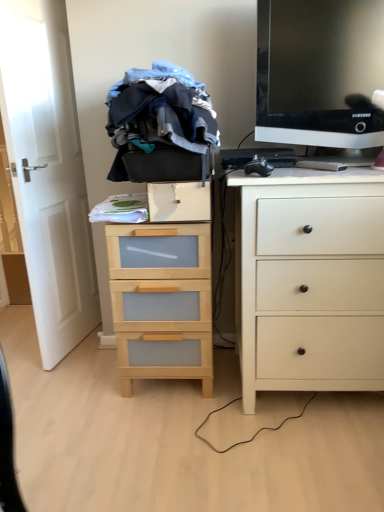
Question: Is point (289, 148) closer or farther from the camera than point (147, 356)?

Choices:
 (A) farther
 (B) closer

Answer: (B)

Question: From the image's perspective, is black plastic keyboard at center above or below wooden chest of drawers at center, the 1th chest of drawers from the left?

Choices:
 (A) below
 (B) above

Answer: (B)

Question: Estimate the real-world distances between objects in this image. Which object is farther from the wooden drawer at center?

Choices:
 (A) black plastic computer mouse at upper right
 (B) black plastic keyboard at center
 (C) wooden chest of drawers at center, the 1th chest of drawers from the left
 (D) white matte chest of drawers at right, the 1th chest of drawers viewed from the right
 (E) blue cotton clothes at center

Answer: (D)

Question: Which is nearer to the black plastic computer mouse at upper right?

Choices:
 (A) black glossy monitor at upper right
 (B) wooden chest of drawers at center, the 1th chest of drawers from the left
 (C) blue cotton clothes at center
 (D) black plastic keyboard at center
 (E) white matte chest of drawers at right, the 1th chest of drawers viewed from the right

Answer: (D)